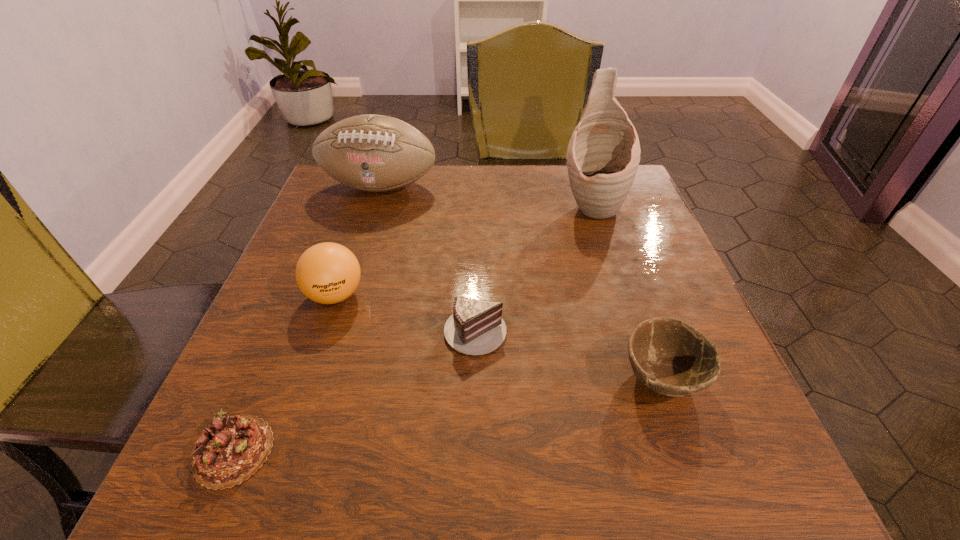
This screenshot has width=960, height=540. I want to click on pitcher, so click(x=603, y=155).

The image size is (960, 540). Identify the location of the fifth shortest object. (375, 153).

The image size is (960, 540). Identify the location of ping-pong ball. (327, 273).

Where is `bowl`? The height and width of the screenshot is (540, 960). bowl is located at coordinates [669, 356].

What are the coordinates of `the farther chocolate cake` in the screenshot? It's located at (476, 327).

The image size is (960, 540). Identify the location of the taller chocolate cake. (476, 327).

You are a GUI agent. You are given a task and a screenshot of the screen. Output one action in this format:
    pyautogui.click(x=<x>, y=<y>)
    Task: Click on the nearer chocolate cake
    The image size is (960, 540).
    Given the screenshot: What is the action you would take?
    pyautogui.click(x=229, y=451)

The height and width of the screenshot is (540, 960). I want to click on the nearest object, so click(229, 451).

You are a GUI agent. You are given a task and a screenshot of the screen. Output one action in this format:
    pyautogui.click(x=<x>, y=<y>)
    Task: Click on the vacant area located at the spout of the pitcher
    
    Given the screenshot: What is the action you would take?
    pyautogui.click(x=609, y=262)

What are the coordinates of `vacant space situated 0.300m on the laces of the football (American)` in the screenshot? It's located at (346, 296).